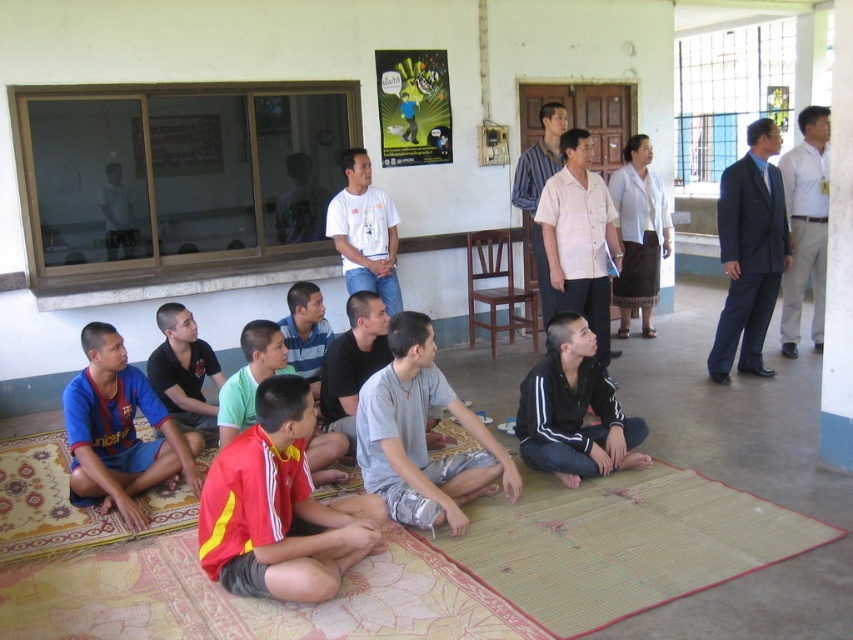
Who is taller, blue jersey at lower left or striped cotton shirt at center?

striped cotton shirt at center

Is point (129, 452) positioned after point (556, 163)?

No, (129, 452) is in front of (556, 163).

Where is `blue jersey at lower left`? The image size is (853, 640). blue jersey at lower left is located at coordinates (119, 432).

Is the position of natural bamboo mat at lower center more distant than that of striped cotton shirt at center?

A: No, natural bamboo mat at lower center is closer to the viewer.

This screenshot has width=853, height=640. I want to click on natural bamboo mat at lower center, so click(619, 544).

Where is `natural bamboo mat at lower center`? This screenshot has height=640, width=853. natural bamboo mat at lower center is located at coordinates (619, 544).

Can you confirm if dark blue suit at right is taller than white shirt at upper right?

Incorrect, dark blue suit at right's height is not larger of white shirt at upper right's.

Who is positioned more to the right, dark blue suit at right or white shirt at upper right?

white shirt at upper right

Does point (761, 291) come farther from viewer compared to point (822, 253)?

No.

At what (x,y) coordinates should I click in order to perform the action: click on dark blue suit at right. Please return your answer as a coordinate pair (x, y). Looking at the image, I should click on (749, 252).